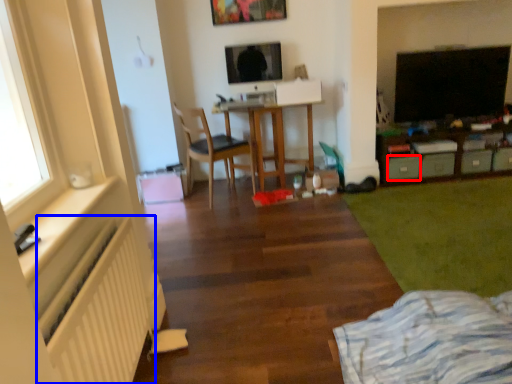
Question: Among these objects, which one is nearest to the camera, drawer (highlighted by a red box) or radiator (highlighted by a blue box)?

Choices:
 (A) drawer
 (B) radiator

Answer: (B)